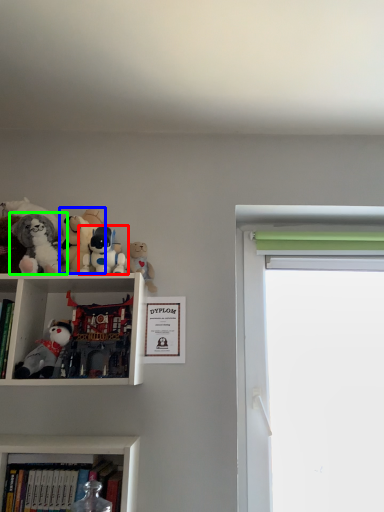
Question: Which is farther away from toy (highlighted by a red box)? toy (highlighted by a blue box) or toy (highlighted by a green box)?

Choices:
 (A) toy
 (B) toy

Answer: (B)